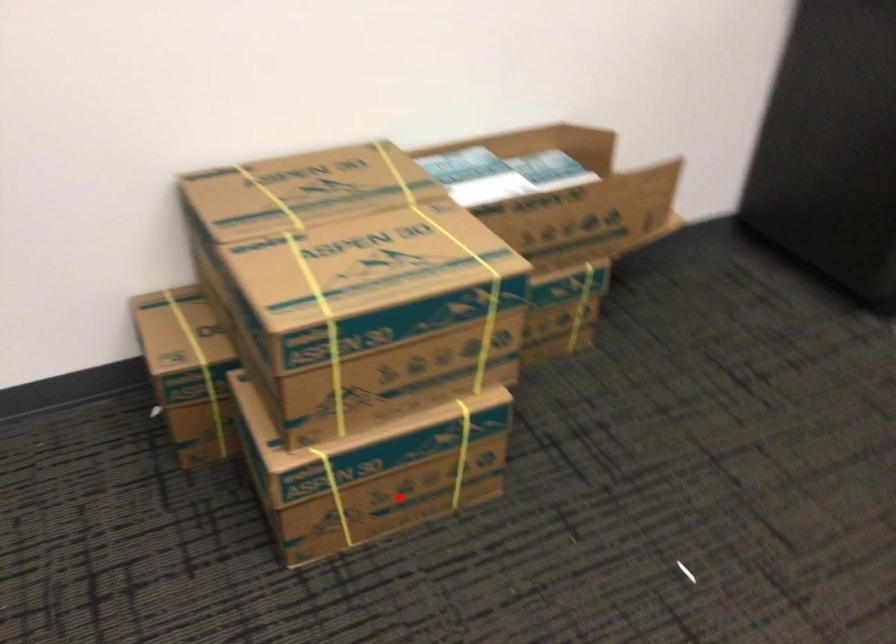
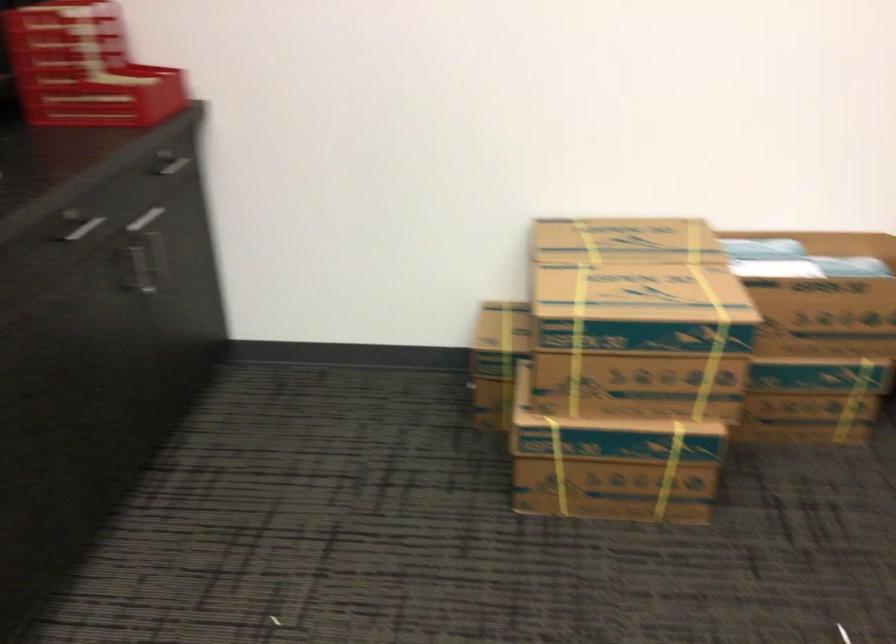
In the second image, find the point that corresponds to the highlighted location in the first image.

(613, 489)